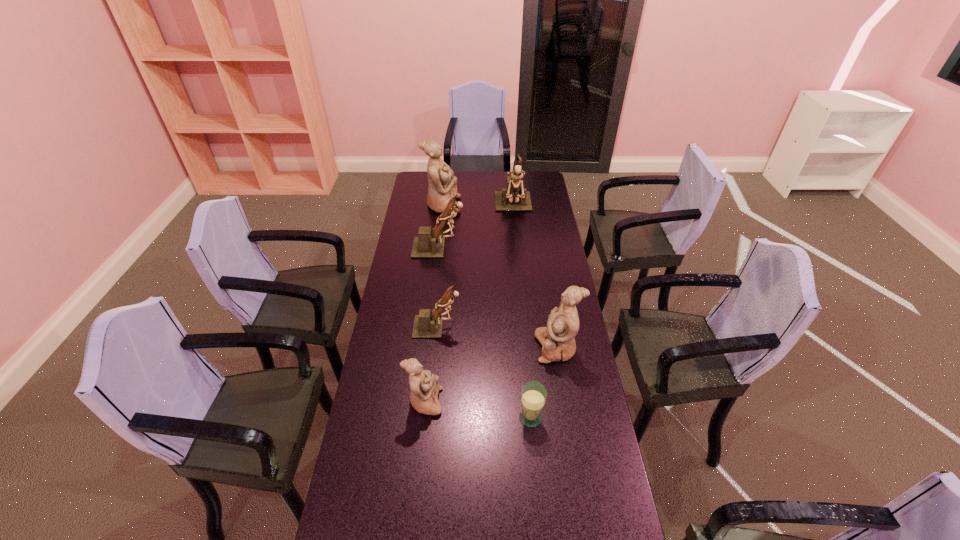
You are a GUI agent. You are given a task and a screenshot of the screen. Output one action in this format:
    pyautogui.click(x=<x>, y=<y>)
    Task: Click on the shortest object
    This screenshot has height=540, width=960.
    Given the screenshot: What is the action you would take?
    pyautogui.click(x=533, y=395)

You are a GUI agent. You are given a task and a screenshot of the screen. Output one action in this format:
    pyautogui.click(x=<x>, y=<y>)
    Task: Click on the glass
    Image resolution: width=960 pixels, height=540 pixels.
    Given the screenshot: What is the action you would take?
    pyautogui.click(x=533, y=395)

I want to click on free region located on the front-facing side of the farthest white figurine, so click(x=500, y=206).

Where is `vacant space located 0.180m on the front-facing side of the biggest brown figurine`? This screenshot has width=960, height=540. vacant space located 0.180m on the front-facing side of the biggest brown figurine is located at coordinates (517, 246).

Locate an element on the screen. Image resolution: width=960 pixels, height=540 pixels. vacant point located on the front-facing side of the second nearest brown figurine is located at coordinates (540, 248).

Identify the location of free location located on the front-facing side of the rightmost white figurine. (438, 348).

You are a GUI agent. You are given a task and a screenshot of the screen. Output one action in this format:
    pyautogui.click(x=<x>, y=<y>)
    Task: Click on the free location located 0.320m on the front-facing side of the rightmost white figurine
    
    Given the screenshot: What is the action you would take?
    pyautogui.click(x=450, y=348)

Where is `free region located 0.090m on the front-facing side of the rightmost white figurine`? The height and width of the screenshot is (540, 960). free region located 0.090m on the front-facing side of the rightmost white figurine is located at coordinates (512, 348).

Find the location of a particular element. The height and width of the screenshot is (540, 960). vacant space located on the front-facing side of the nearest figurine is located at coordinates (519, 402).

Find the location of a particular element. This screenshot has height=540, width=960. vacant position located on the front-facing side of the smallest brown figurine is located at coordinates (518, 327).